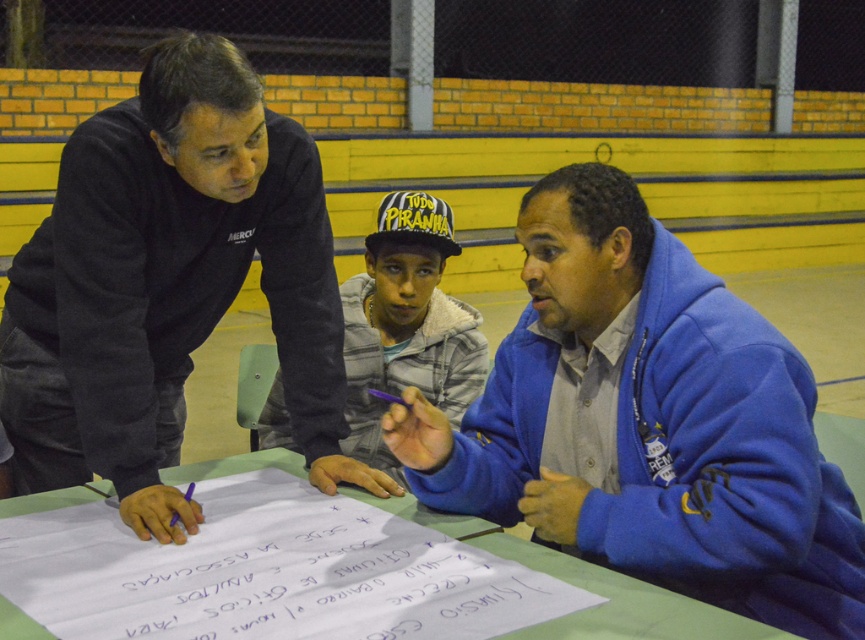
Between blue fleece jacket at center and white paper at center, which one is positioned lower?

white paper at center is below.

This screenshot has width=865, height=640. What are the coordinates of `blue fleece jacket at center` in the screenshot? It's located at (646, 422).

This screenshot has height=640, width=865. In order to click on blue fleece jacket at center in this screenshot , I will do pyautogui.click(x=646, y=422).

Is blue fleece jacket at center thinner than white fleece jacket at center?

In fact, blue fleece jacket at center might be wider than white fleece jacket at center.

Is point (741, 547) closer to camera compared to point (346, 413)?

Yes, it is.

The image size is (865, 640). What do you see at coordinates (646, 422) in the screenshot?
I see `blue fleece jacket at center` at bounding box center [646, 422].

Where is `blue fleece jacket at center`? The image size is (865, 640). blue fleece jacket at center is located at coordinates (646, 422).

Between white paper at center and green paper at center, which one has less height?

Standing shorter between the two is white paper at center.

Is white paper at center thinner than green paper at center?

Indeed, white paper at center has a lesser width compared to green paper at center.

Does point (418, 554) come behind point (498, 547)?

No.

Identify the location of white paper at center. (331, 580).